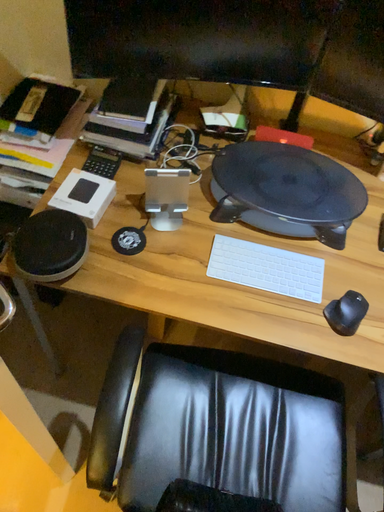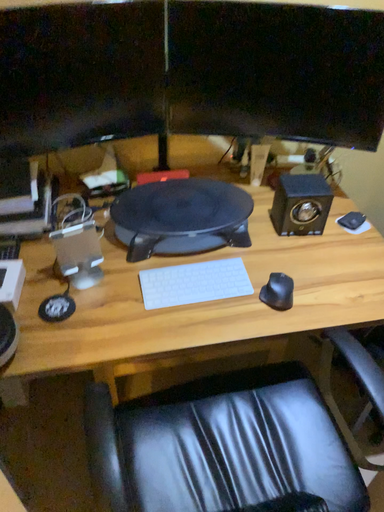
Question: Which way did the camera rotate in the video?

Choices:
 (A) rotated left
 (B) rotated right

Answer: (B)